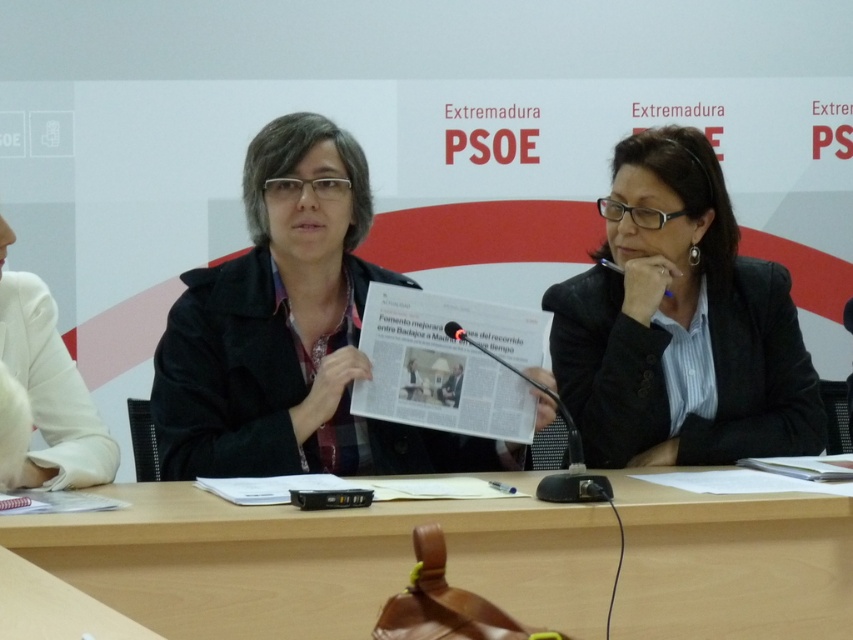
Question: Can you confirm if matte black coat at center is wider than black matte blazer at center?

Choices:
 (A) no
 (B) yes

Answer: (B)

Question: Does wooden table at center appear on the right side of matte black coat at center?

Choices:
 (A) yes
 (B) no

Answer: (A)

Question: Considering the relative positions of wooden table at center and black matte blazer at center in the image provided, where is wooden table at center located with respect to black matte blazer at center?

Choices:
 (A) left
 (B) right

Answer: (A)

Question: Which of the following is the farthest from the observer?

Choices:
 (A) (654, 499)
 (B) (9, 340)
 (C) (281, 250)

Answer: (C)

Question: Among these points, which one is nearest to the camera?

Choices:
 (A) 840,611
 (B) 32,298
 (C) 271,448

Answer: (A)

Question: Which point appears closest to the camera in this image?

Choices:
 (A) (653, 360)
 (B) (271, 332)

Answer: (B)